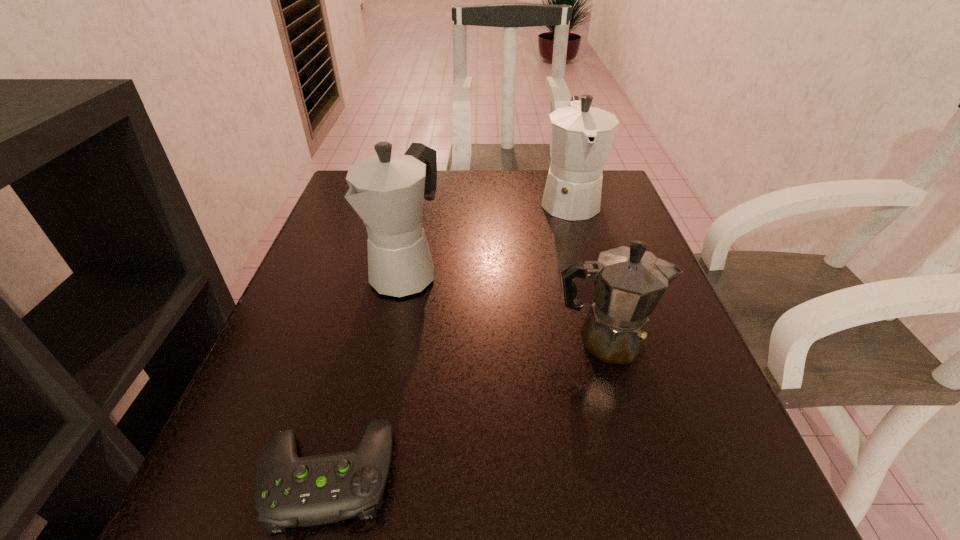
Locate an element on the screen. object at the far edge is located at coordinates (581, 136).

This screenshot has height=540, width=960. I want to click on object situated at the near edge, so click(x=289, y=491).

This screenshot has width=960, height=540. In order to click on coffeepot situated at the left edge in this screenshot , I will do `click(387, 190)`.

This screenshot has width=960, height=540. I want to click on control that is positioned at the left edge, so click(x=289, y=491).

What are the coordinates of `object present at the near left corner` in the screenshot? It's located at (289, 491).

Identify the location of object that is at the far right corner. (581, 136).

Where is `vacant space at the far edge`? Image resolution: width=960 pixels, height=540 pixels. vacant space at the far edge is located at coordinates (436, 208).

The width and height of the screenshot is (960, 540). In the image, there is a desktop. Identify the location of free space at the near edge. (562, 478).

In the image, there is a desktop. Where is `free space at the left edge`? free space at the left edge is located at coordinates (343, 224).

In order to click on vacant space at the right edge of the desktop in this screenshot , I will do `click(674, 360)`.